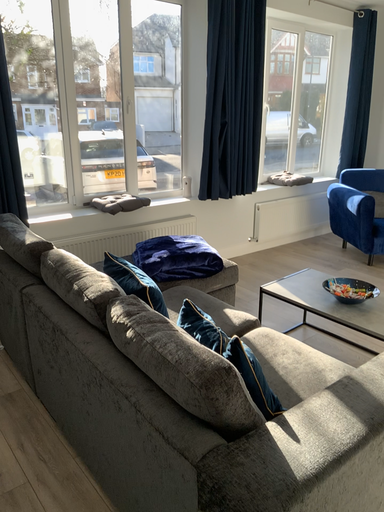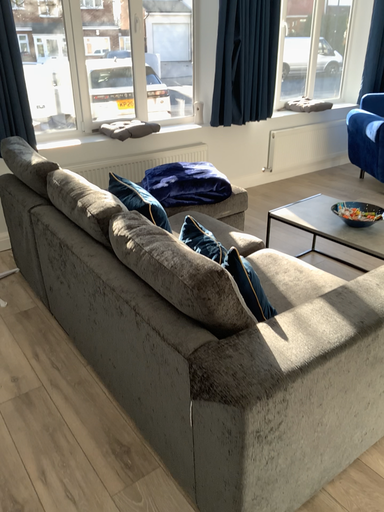
Question: How did the camera likely rotate when shooting the video?

Choices:
 (A) rotated upward
 (B) rotated downward

Answer: (B)